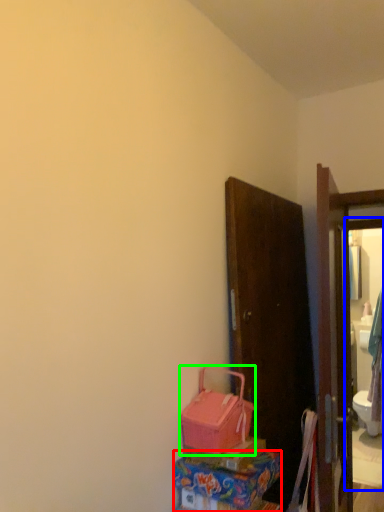
Question: Which object is positioned farthest from box (highlighted by a red box)? Select from mirror (highlighted by a blue box) and luggage (highlighted by a green box).

Choices:
 (A) mirror
 (B) luggage

Answer: (A)